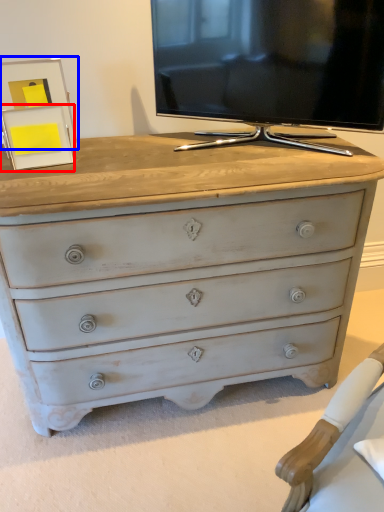
Question: Which object appears farthest to the camera in this image, picture frame (highlighted by a red box) or picture frame (highlighted by a blue box)?

Choices:
 (A) picture frame
 (B) picture frame

Answer: (B)